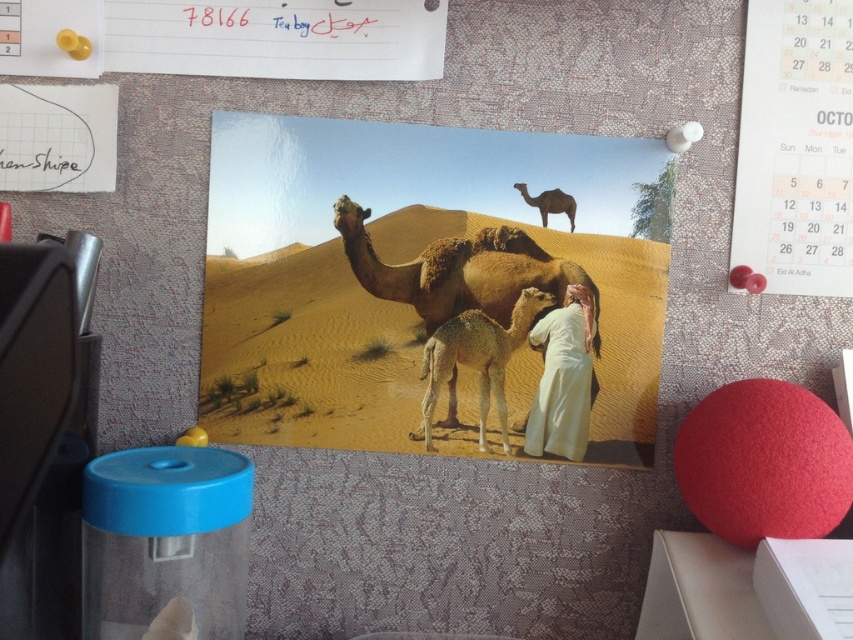
Who is higher up, white paper calendar at upper right or brown fuzzy camel at center?

white paper calendar at upper right is higher up.

Is point (819, 196) farther from camera compared to point (519, 301)?

No.

Find the location of a particular element. The width and height of the screenshot is (853, 640). white paper calendar at upper right is located at coordinates (795, 147).

Describe the element at coordinates (795, 147) in the screenshot. This screenshot has width=853, height=640. I see `white paper calendar at upper right` at that location.

Find the location of a particular element. white paper calendar at upper right is located at coordinates (795, 147).

Is point (833, 72) in front of point (479, 268)?

Yes.

Find the location of a particular element. The width and height of the screenshot is (853, 640). white paper calendar at upper right is located at coordinates (795, 147).

Measure the distance between white paper calendar at upper right and brown matte camel at upper center.

white paper calendar at upper right is 19.85 centimeters away from brown matte camel at upper center.

Can you confirm if white paper calendar at upper right is positioned below brown matte camel at upper center?

No, white paper calendar at upper right is not below brown matte camel at upper center.

Who is more forward, (746, 216) or (572, 228)?

Positioned in front is point (572, 228).

I want to click on white paper calendar at upper right, so click(795, 147).